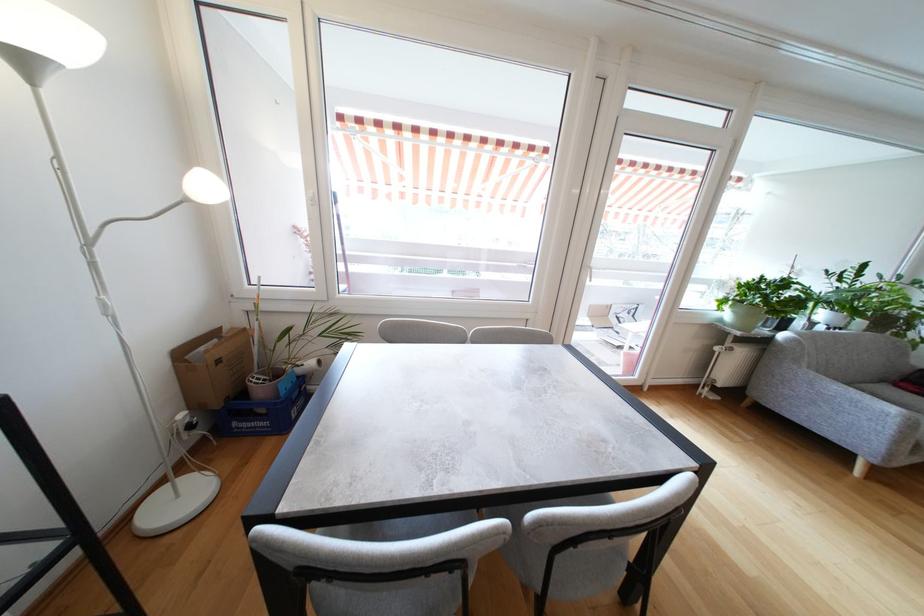
This screenshot has height=616, width=924. What are the coordinates of `sofa armrest` in the screenshot? It's located at (849, 399).